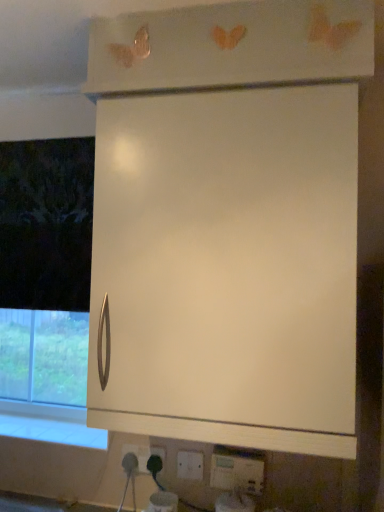
I want to click on white plastic socket at lower center, arranged as the first electric outlet when viewed from the left, so click(x=138, y=456).

The image size is (384, 512). Describe the element at coordinates (228, 224) in the screenshot. I see `white matte cabinet at center` at that location.

In order to face white matte cabinet at center, should I rotate leftwards or rightwards?

It's best to rotate right around 4.381 degrees.

This screenshot has width=384, height=512. Find the location of `white plastic socket at lower center, arranged as the first electric outlet when viewed from the left`. white plastic socket at lower center, arranged as the first electric outlet when viewed from the left is located at coordinates (138, 456).

Is white plastic electric outlet at lower center, which ranks as the 2th electric outlet in right-to-left order, in front of white matte cabinet at center?

No, it is not.

Image resolution: width=384 pixels, height=512 pixels. What are the coordinates of `cabinetry that appears on the right of white plastic electric outlet at lower center, which appears as the 2th electric outlet when viewed from the back` in the screenshot? It's located at (228, 224).

Looking at this image, from the image's perspective, between white plastic electric outlet at lower center, marked as the second electric outlet in a left-to-right arrangement, and white matte cabinet at center, who is located below?

From the image's view, white plastic electric outlet at lower center, marked as the second electric outlet in a left-to-right arrangement, is below.

Which of these two, white plastic electric outlet at lower center, marked as the second electric outlet in a left-to-right arrangement, or white plastic electric outlet at lower center, placed as the 1th electric outlet when sorted from front to back, is wider?

white plastic electric outlet at lower center, placed as the 1th electric outlet when sorted from front to back.

Looking at this image, is white plastic electric outlet at lower center, marked as the second electric outlet in a left-to-right arrangement, touching white plastic electric outlet at lower center, placed as the 1th electric outlet when sorted from front to back?

No, white plastic electric outlet at lower center, marked as the second electric outlet in a left-to-right arrangement, is not next to white plastic electric outlet at lower center, placed as the 1th electric outlet when sorted from front to back.

Which of these two, white plastic electric outlet at lower center, marked as the second electric outlet in a left-to-right arrangement, or white plastic electric outlet at lower center, the 3th electric outlet positioned from the left, stands shorter?

Standing shorter between the two is white plastic electric outlet at lower center, marked as the second electric outlet in a left-to-right arrangement.

Based on their positions, is white plastic electric outlet at lower center, which appears as the 2th electric outlet when viewed from the back, located to the left or right of white plastic electric outlet at lower center, placed as the 3th electric outlet when sorted from back to front?

white plastic electric outlet at lower center, which appears as the 2th electric outlet when viewed from the back, is positioned on white plastic electric outlet at lower center, placed as the 3th electric outlet when sorted from back to front,'s left side.

Identify the location of electric outlet that is the 3rd object directly below the white glossy window sill at lower left (from a real-world perspective). (190, 465).

Does white plastic electric outlet at lower center, which appears as the 2th electric outlet when viewed from the back, have a greater width compared to white glossy window sill at lower left?

Incorrect, the width of white plastic electric outlet at lower center, which appears as the 2th electric outlet when viewed from the back, does not surpass that of white glossy window sill at lower left.

Which object is more forward, white plastic electric outlet at lower center, the second electric outlet when ordered from front to back, or white glossy window sill at lower left?

white plastic electric outlet at lower center, the second electric outlet when ordered from front to back, is in front.

Is point (185, 465) behind point (84, 444)?

No, (185, 465) is closer to viewer.

From the picture: Is white plastic electric outlet at lower center, placed as the 3th electric outlet when sorted from back to front, in front of white plastic socket at lower center, the third electric outlet positioned from the right?

Yes.

Which of these two, white plastic electric outlet at lower center, placed as the 3th electric outlet when sorted from back to front, or white plastic socket at lower center, marked as the third electric outlet in a front-to-back arrangement, is wider?

With larger width is white plastic electric outlet at lower center, placed as the 3th electric outlet when sorted from back to front.

Considering the relative positions of white plastic electric outlet at lower center, the first electric outlet from the right, and white plastic socket at lower center, arranged as the first electric outlet when viewed from the left, in the image provided, is white plastic electric outlet at lower center, the first electric outlet from the right, to the left or to the right of white plastic socket at lower center, arranged as the first electric outlet when viewed from the left,?

white plastic electric outlet at lower center, the first electric outlet from the right, is to the right of white plastic socket at lower center, arranged as the first electric outlet when viewed from the left.

In order to click on electric outlet that is the 2nd one when counting rightward from the white plastic socket at lower center, arranged as the first electric outlet when viewed from the left in this screenshot , I will do [237, 470].

Is white plastic electric outlet at lower center, the 3th electric outlet positioned from the left, wider or thinner than white plastic electric outlet at lower center, the second electric outlet when ordered from front to back?

In the image, white plastic electric outlet at lower center, the 3th electric outlet positioned from the left, appears to be wider than white plastic electric outlet at lower center, the second electric outlet when ordered from front to back.

From a real-world perspective, is white plastic electric outlet at lower center, the first electric outlet from the right, above or below white plastic electric outlet at lower center, marked as the second electric outlet in a left-to-right arrangement?

In terms of real-world spatial position, white plastic electric outlet at lower center, the first electric outlet from the right, is above white plastic electric outlet at lower center, marked as the second electric outlet in a left-to-right arrangement.

Is the position of white plastic electric outlet at lower center, the first electric outlet from the right, more distant than that of white plastic electric outlet at lower center, which appears as the 2th electric outlet when viewed from the back?

No, white plastic electric outlet at lower center, the first electric outlet from the right, is closer to the viewer.

Does white plastic electric outlet at lower center, placed as the 3th electric outlet when sorted from back to front, turn towards white plastic electric outlet at lower center, which appears as the 2th electric outlet when viewed from the back?

No, white plastic electric outlet at lower center, placed as the 3th electric outlet when sorted from back to front, is not oriented towards white plastic electric outlet at lower center, which appears as the 2th electric outlet when viewed from the back.

Is white glossy window sill at lower left behind white matte cabinet at center?

Yes.

In terms of size, does white glossy window sill at lower left appear bigger or smaller than white matte cabinet at center?

Considering their sizes, white glossy window sill at lower left takes up less space than white matte cabinet at center.

Considering the sizes of objects white glossy window sill at lower left and white matte cabinet at center in the image provided, who is thinner, white glossy window sill at lower left or white matte cabinet at center?

With smaller width is white glossy window sill at lower left.

In the scene shown: Is white glossy window sill at lower left to the left of white matte cabinet at center from the viewer's perspective?

Correct, you'll find white glossy window sill at lower left to the left of white matte cabinet at center.

Which object is wider, white plastic electric outlet at lower center, placed as the 3th electric outlet when sorted from back to front, or white matte cabinet at center?

white matte cabinet at center is wider.

Is the depth of white plastic electric outlet at lower center, placed as the 3th electric outlet when sorted from back to front, less than that of white matte cabinet at center?

That is False.

Is white plastic electric outlet at lower center, the first electric outlet from the right, not close to white matte cabinet at center?

white plastic electric outlet at lower center, the first electric outlet from the right, is near white matte cabinet at center, not far away.

Is white plastic electric outlet at lower center, the 3th electric outlet positioned from the left, taller or shorter than white matte cabinet at center?

In the image, white plastic electric outlet at lower center, the 3th electric outlet positioned from the left, appears to be shorter than white matte cabinet at center.

I want to click on electric outlet that is the 2nd object located behind the white matte cabinet at center, so coord(190,465).

Image resolution: width=384 pixels, height=512 pixels. In order to click on electric outlet on the right of white plastic electric outlet at lower center, which appears as the 2th electric outlet when viewed from the back in this screenshot , I will do `click(237, 470)`.

When comparing their distances from white plastic electric outlet at lower center, the 3th electric outlet positioned from the left, does white plastic electric outlet at lower center, which appears as the 2th electric outlet when viewed from the back, or white plastic socket at lower center, marked as the third electric outlet in a front-to-back arrangement, seem closer?

white plastic electric outlet at lower center, which appears as the 2th electric outlet when viewed from the back, is positioned closer to the anchor white plastic electric outlet at lower center, the 3th electric outlet positioned from the left.

Looking at the image, which one is located further to white plastic electric outlet at lower center, which appears as the 2th electric outlet when viewed from the back, white plastic electric outlet at lower center, the 3th electric outlet positioned from the left, or white plastic socket at lower center, arranged as the first electric outlet when viewed from the left?

white plastic socket at lower center, arranged as the first electric outlet when viewed from the left, is positioned further to the anchor white plastic electric outlet at lower center, which appears as the 2th electric outlet when viewed from the back.

Considering their positions, is white plastic socket at lower center, the 1th electric outlet in the back-to-front sequence, positioned closer to white glossy window sill at lower left than white plastic electric outlet at lower center, the second electric outlet when ordered from front to back?

Based on the image, white plastic socket at lower center, the 1th electric outlet in the back-to-front sequence, appears to be nearer to white glossy window sill at lower left.

Looking at the image, which one is located further to white matte cabinet at center, white plastic electric outlet at lower center, marked as the second electric outlet in a left-to-right arrangement, or white glossy window sill at lower left?

white glossy window sill at lower left is positioned further to the anchor white matte cabinet at center.

From the image, which object appears to be nearer to white glossy window sill at lower left, white matte cabinet at center or white plastic socket at lower center, the third electric outlet positioned from the right?

white plastic socket at lower center, the third electric outlet positioned from the right.

Estimate the real-world distances between objects in this image. Which object is closer to white matte cabinet at center, white plastic socket at lower center, arranged as the first electric outlet when viewed from the left, or white glossy window sill at lower left?

white glossy window sill at lower left lies closer to white matte cabinet at center than the other object.

When comparing their distances from white plastic electric outlet at lower center, which ranks as the 2th electric outlet in right-to-left order, does white glossy window sill at lower left or white matte cabinet at center seem further?

The object further to white plastic electric outlet at lower center, which ranks as the 2th electric outlet in right-to-left order, is white matte cabinet at center.

When comparing their distances from white plastic electric outlet at lower center, the second electric outlet when ordered from front to back, does white plastic electric outlet at lower center, placed as the 3th electric outlet when sorted from back to front, or white glossy window sill at lower left seem closer?

white plastic electric outlet at lower center, placed as the 3th electric outlet when sorted from back to front, is closer to white plastic electric outlet at lower center, the second electric outlet when ordered from front to back.

At what (x,y) coordinates should I click in order to perform the action: click on electric outlet between white matte cabinet at center and white plastic electric outlet at lower center, placed as the 1th electric outlet when sorted from front to back, vertically. Please return your answer as a coordinate pair (x, y). Looking at the image, I should click on (138, 456).

Identify the location of electric outlet between white plastic socket at lower center, the third electric outlet positioned from the right, and white plastic electric outlet at lower center, placed as the 1th electric outlet when sorted from front to back. The width and height of the screenshot is (384, 512). (190, 465).

Where is `window sill between white matte cabinet at center and white plastic socket at lower center, the 1th electric outlet in the back-to-front sequence, from top to bottom`? The width and height of the screenshot is (384, 512). window sill between white matte cabinet at center and white plastic socket at lower center, the 1th electric outlet in the back-to-front sequence, from top to bottom is located at coordinates (50, 424).

The height and width of the screenshot is (512, 384). What are the coordinates of `electric outlet located between white glossy window sill at lower left and white plastic electric outlet at lower center, marked as the second electric outlet in a left-to-right arrangement, in the left-right direction` in the screenshot? It's located at (138, 456).